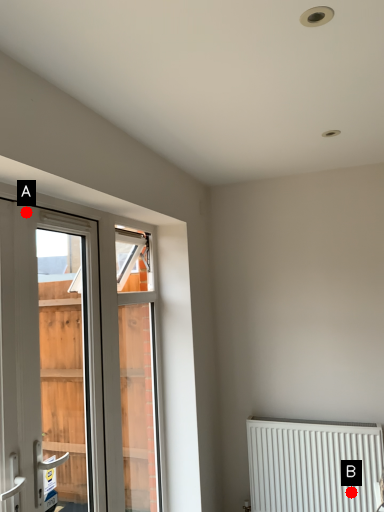
Question: Two points are circled on the image, labeled by A and B beside each circle. Which point is further to the camera?

Choices:
 (A) A is further
 (B) B is further

Answer: (B)